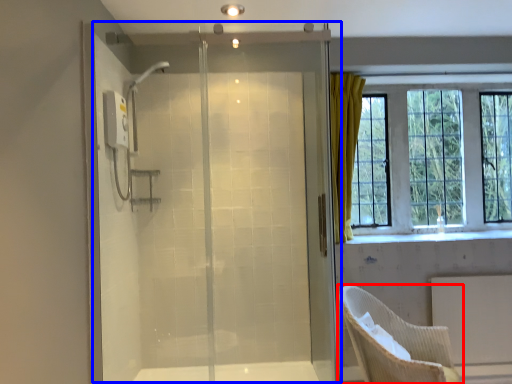
Question: Which point is further to the camera, chair (highlighted by a red box) or screen door (highlighted by a blue box)?

Choices:
 (A) chair
 (B) screen door

Answer: (B)